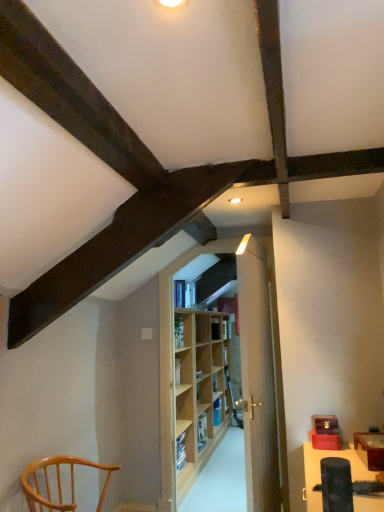
Locate an element on the screen. The height and width of the screenshot is (512, 384). black plastic lift at lower right is located at coordinates (336, 485).

Describe the element at coordinates (199, 391) in the screenshot. I see `light wood shelf at center, the second shelf from the right` at that location.

What do you see at coordinates (217, 412) in the screenshot? I see `wooden bookshelf at center, placed as the 1th shelf when sorted from bottom to top` at bounding box center [217, 412].

Image resolution: width=384 pixels, height=512 pixels. What do you see at coordinates (258, 378) in the screenshot? I see `light wood door at center` at bounding box center [258, 378].

Find the location of a particular element. This screenshot has height=512, width=384. black plastic lift at lower right is located at coordinates (336, 485).

From a real-world perspective, is light wood door at center beneath light wood shelf at center, which is the 1th shelf in left-to-right order?

No.

Consider the image. Is light wood door at center not inside light wood shelf at center, placed as the 2th shelf when sorted from bottom to top?

That's correct, light wood door at center is outside of light wood shelf at center, placed as the 2th shelf when sorted from bottom to top.

Is light wood door at center facing away from light wood shelf at center, which is the 1th shelf in left-to-right order?

That's not correct — light wood door at center is not looking away from light wood shelf at center, which is the 1th shelf in left-to-right order.

Considering the positions of point (106, 466) and point (194, 334), is point (106, 466) closer or farther from the camera than point (194, 334)?

Point (106, 466) is positioned closer to the camera compared to point (194, 334).

Which object is wider, light brown wood chair at lower left or light wood shelf at center, positioned as the second shelf in back-to-front order?

Wider between the two is light brown wood chair at lower left.

In the image, is light brown wood chair at lower left on the left side or the right side of light wood shelf at center, marked as the 1th shelf in a top-to-bottom arrangement?

Clearly, light brown wood chair at lower left is on the left of light wood shelf at center, marked as the 1th shelf in a top-to-bottom arrangement, in the image.

Considering the sizes of objects light brown wood chair at lower left and light wood shelf at center, the second shelf from the right, in the image provided, who is bigger, light brown wood chair at lower left or light wood shelf at center, the second shelf from the right,?

Bigger between the two is light wood shelf at center, the second shelf from the right.

Can you confirm if matte black speaker at lower right is shorter than light wood shelf at center, marked as the 1th shelf in a top-to-bottom arrangement?

Correct, matte black speaker at lower right is not as tall as light wood shelf at center, marked as the 1th shelf in a top-to-bottom arrangement.

Choose the correct answer: Is matte black speaker at lower right inside light wood shelf at center, marked as the 1th shelf in a top-to-bottom arrangement, or outside it?

matte black speaker at lower right is outside light wood shelf at center, marked as the 1th shelf in a top-to-bottom arrangement.

Which object is positioned more to the left, matte black speaker at lower right or light wood shelf at center, which is the 1th shelf in left-to-right order?

Positioned to the left is light wood shelf at center, which is the 1th shelf in left-to-right order.

Is matte black speaker at lower right bigger or smaller than light wood shelf at center, which is the 1th shelf in left-to-right order?

Clearly, matte black speaker at lower right is smaller in size than light wood shelf at center, which is the 1th shelf in left-to-right order.

Considering the sizes of objects black plastic lift at lower right and light wood door at center in the image provided, who is shorter, black plastic lift at lower right or light wood door at center?

black plastic lift at lower right.

From a real-world perspective, which object rests below the other?

black plastic lift at lower right, from a real-world perspective.

The width and height of the screenshot is (384, 512). Identify the location of door on the left of black plastic lift at lower right. (258, 378).

Can you tell me how much black plastic lift at lower right and light wood door at center differ in facing direction?

They differ by 96.4 degrees in their facing directions.

Is black plastic lift at lower right oriented towards light wood shelf at center, positioned as the second shelf in back-to-front order?

No, black plastic lift at lower right does not turn towards light wood shelf at center, positioned as the second shelf in back-to-front order.

Considering the relative sizes of black plastic lift at lower right and light wood shelf at center, placed as the 2th shelf when sorted from bottom to top, in the image provided, is black plastic lift at lower right thinner than light wood shelf at center, placed as the 2th shelf when sorted from bottom to top,?

Yes.

The image size is (384, 512). I want to click on the 1st shelf below when counting from the black plastic lift at lower right (from the image's perspective), so click(x=199, y=391).

Considering the relative sizes of black plastic lift at lower right and light wood shelf at center, marked as the 1th shelf in a top-to-bottom arrangement, in the image provided, is black plastic lift at lower right shorter than light wood shelf at center, marked as the 1th shelf in a top-to-bottom arrangement,?

Yes, black plastic lift at lower right is shorter than light wood shelf at center, marked as the 1th shelf in a top-to-bottom arrangement.

Is matte black speaker at lower right bigger than light brown wood chair at lower left?

Correct, matte black speaker at lower right is larger in size than light brown wood chair at lower left.

I want to click on table below the light brown wood chair at lower left (from a real-world perspective), so click(320, 471).

Can you confirm if matte black speaker at lower right is taller than light brown wood chair at lower left?

Correct, matte black speaker at lower right is much taller as light brown wood chair at lower left.

From a real-world perspective, is matte black speaker at lower right positioned under light brown wood chair at lower left based on gravity?

Yes, from a real-world perspective, matte black speaker at lower right is under light brown wood chair at lower left.

Is light wood door at center in front of or behind wooden bookshelf at center, marked as the 2th shelf in a top-to-bottom arrangement, in the image?

light wood door at center is in front of wooden bookshelf at center, marked as the 2th shelf in a top-to-bottom arrangement.

Is light wood door at center bigger than wooden bookshelf at center, acting as the 1th shelf starting from the right?

Correct, light wood door at center is larger in size than wooden bookshelf at center, acting as the 1th shelf starting from the right.

Which is more to the left, light wood door at center or wooden bookshelf at center, arranged as the 2th shelf when viewed from the left?

wooden bookshelf at center, arranged as the 2th shelf when viewed from the left, is more to the left.

Identify the location of shelf that is the 2nd one when counting leftward from the light wood door at center. (199, 391).

The width and height of the screenshot is (384, 512). What are the coordinates of `the 1st shelf to the right of the light brown wood chair at lower left, starting your count from the anchor` in the screenshot? It's located at (199, 391).

Which object lies further to the anchor point light wood door at center, light brown wood chair at lower left or light wood shelf at center, marked as the 1th shelf in a top-to-bottom arrangement?

light wood shelf at center, marked as the 1th shelf in a top-to-bottom arrangement, is positioned further to the anchor light wood door at center.

When comparing their distances from matte black speaker at lower right, does light wood door at center or wooden bookshelf at center, acting as the 1th shelf starting from the right, seem further?

wooden bookshelf at center, acting as the 1th shelf starting from the right, is positioned further to the anchor matte black speaker at lower right.

When comparing their distances from wooden bookshelf at center, arranged as the 2th shelf when viewed from the left, does light brown wood chair at lower left or light wood door at center seem closer?

Among the two, light wood door at center is located nearer to wooden bookshelf at center, arranged as the 2th shelf when viewed from the left.

Considering their positions, is light wood shelf at center, acting as the 1th shelf starting from the front, positioned closer to black plastic lift at lower right than light brown wood chair at lower left?

light brown wood chair at lower left lies closer to black plastic lift at lower right than the other object.

Considering their positions, is light brown wood chair at lower left positioned closer to light wood door at center than wooden bookshelf at center, marked as the 2th shelf in a top-to-bottom arrangement?

light brown wood chair at lower left lies closer to light wood door at center than the other object.

Estimate the real-world distances between objects in this image. Which object is further from light wood shelf at center, acting as the 1th shelf starting from the front, wooden bookshelf at center, marked as the 2th shelf in a top-to-bottom arrangement, or light brown wood chair at lower left?

Among the two, light brown wood chair at lower left is located further to light wood shelf at center, acting as the 1th shelf starting from the front.

Based on the photo, from the image, which object appears to be nearer to matte black speaker at lower right, black plastic lift at lower right or light brown wood chair at lower left?

black plastic lift at lower right.

Considering their positions, is light brown wood chair at lower left positioned closer to matte black speaker at lower right than light wood door at center?

light wood door at center lies closer to matte black speaker at lower right than the other object.

The height and width of the screenshot is (512, 384). What are the coordinates of `lift between light brown wood chair at lower left and matte black speaker at lower right` in the screenshot? It's located at (336, 485).

Image resolution: width=384 pixels, height=512 pixels. What are the coordinates of `chair between matte black speaker at lower right and light wood shelf at center, which is the 1th shelf in left-to-right order, from front to back` in the screenshot? It's located at (58, 483).

The height and width of the screenshot is (512, 384). What are the coordinates of `shelf between matte black speaker at lower right and wooden bookshelf at center, arranged as the 2th shelf when viewed from the left, in the front-back direction` in the screenshot? It's located at (199, 391).

Locate an element on the screen. door between matte black speaker at lower right and light wood shelf at center, which is the 1th shelf in left-to-right order, along the z-axis is located at coordinates (258, 378).